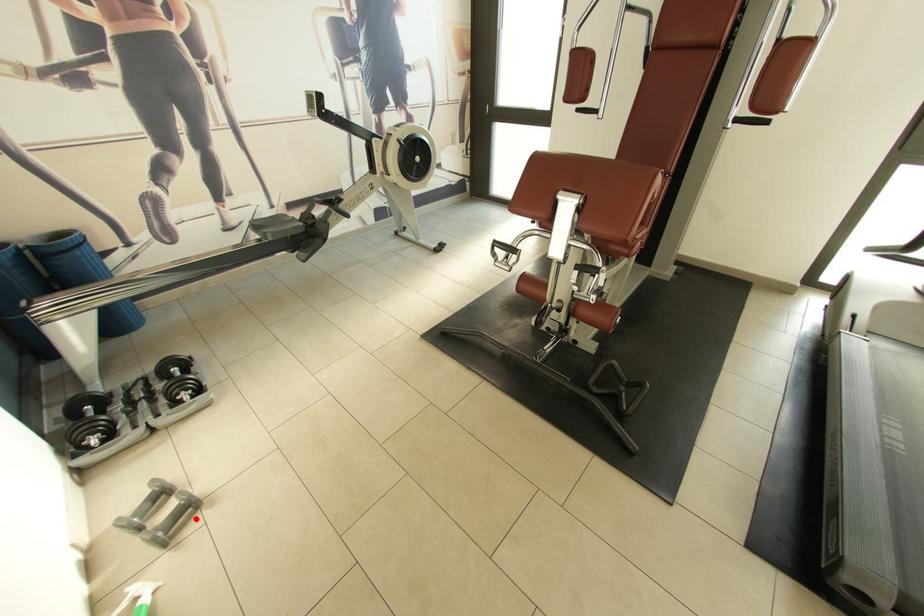
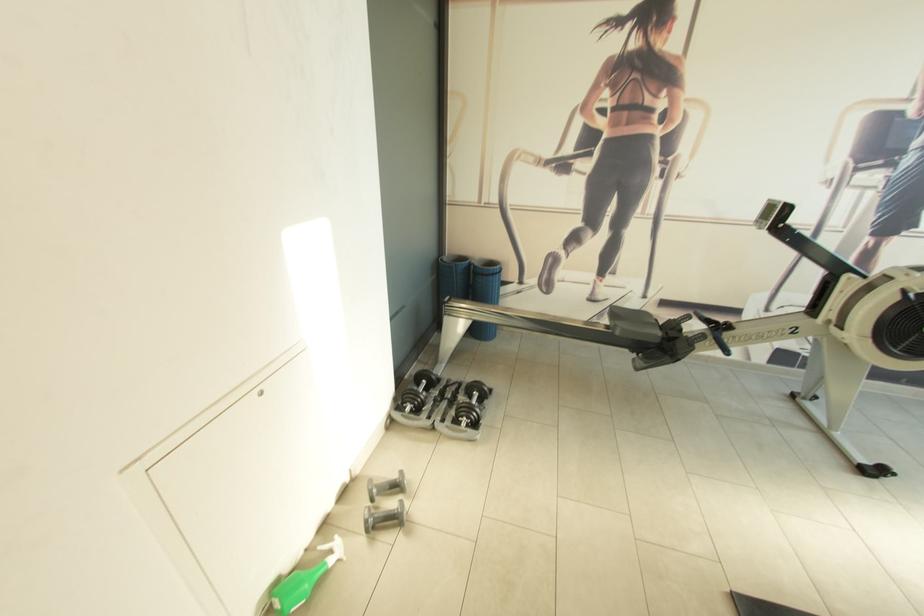
Question: I am providing you with two images of the same scene from different viewpoints. In image1, a red point is highlighted. Considering the same 3D point in image2, which of the following is correct?

Choices:
 (A) It is closer
 (B) It is farther

Answer: (A)